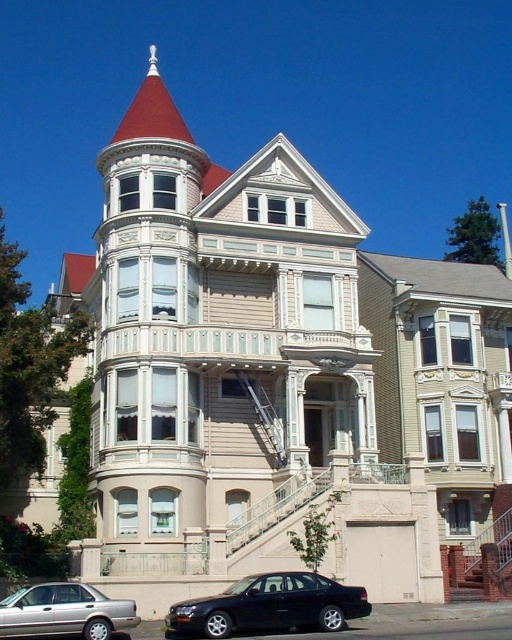
Question: Is black matte sedan at lower center to the left of silver metallic sedan at lower left from the viewer's perspective?

Choices:
 (A) yes
 (B) no

Answer: (B)

Question: Where is black matte sedan at lower center located in relation to silver metallic sedan at lower left in the image?

Choices:
 (A) right
 (B) left

Answer: (A)

Question: Which point is farther to the camera?

Choices:
 (A) (224, 632)
 (B) (50, 632)

Answer: (A)

Question: Which of the following is the farthest from the observer?

Choices:
 (A) (204, 609)
 (B) (25, 608)

Answer: (A)

Question: Which point is closer to the camera taking this photo?

Choices:
 (A) (282, 579)
 (B) (83, 611)

Answer: (B)

Question: Is black matte sedan at lower center smaller than silver metallic sedan at lower left?

Choices:
 (A) no
 (B) yes

Answer: (A)